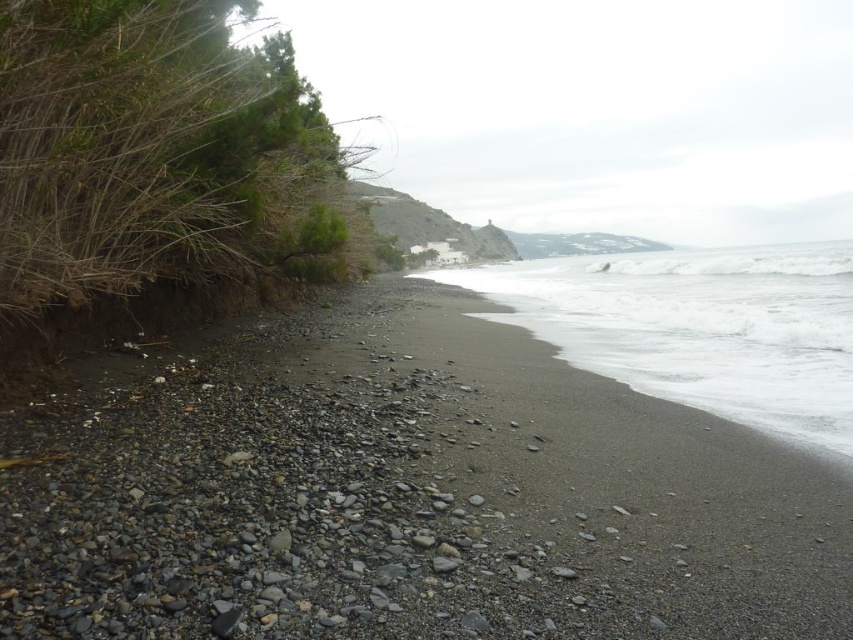
Does smooth pebbles at lower left have a lesser width compared to white foamy water at lower right?

Yes, smooth pebbles at lower left is thinner than white foamy water at lower right.

Between point (125, 589) and point (786, 268), which one is positioned in front?

Point (125, 589) is more forward.

Is point (490, 477) positioned in front of point (741, 410)?

Yes, point (490, 477) is closer to viewer.

This screenshot has height=640, width=853. What are the coordinates of `smooth pebbles at lower left` in the screenshot? It's located at (404, 493).